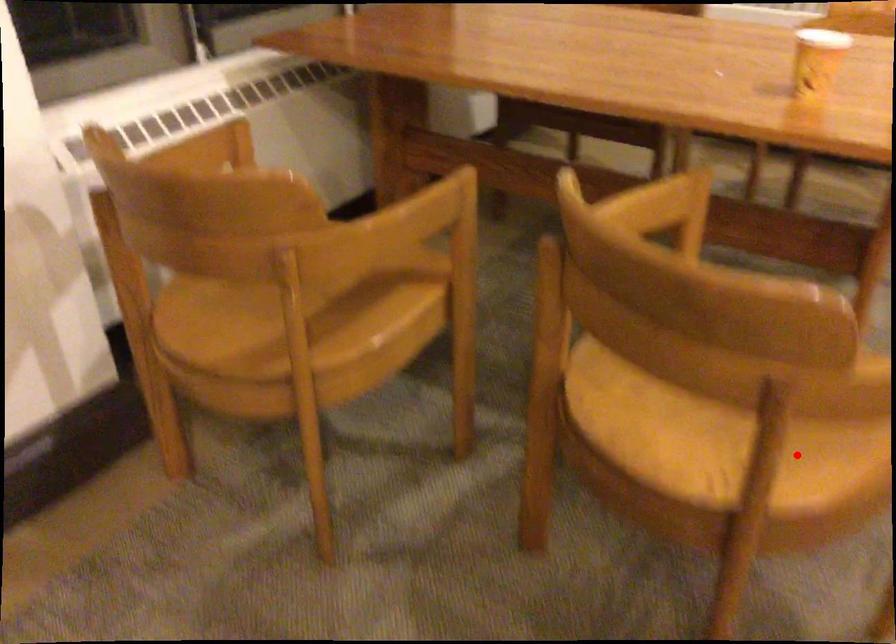
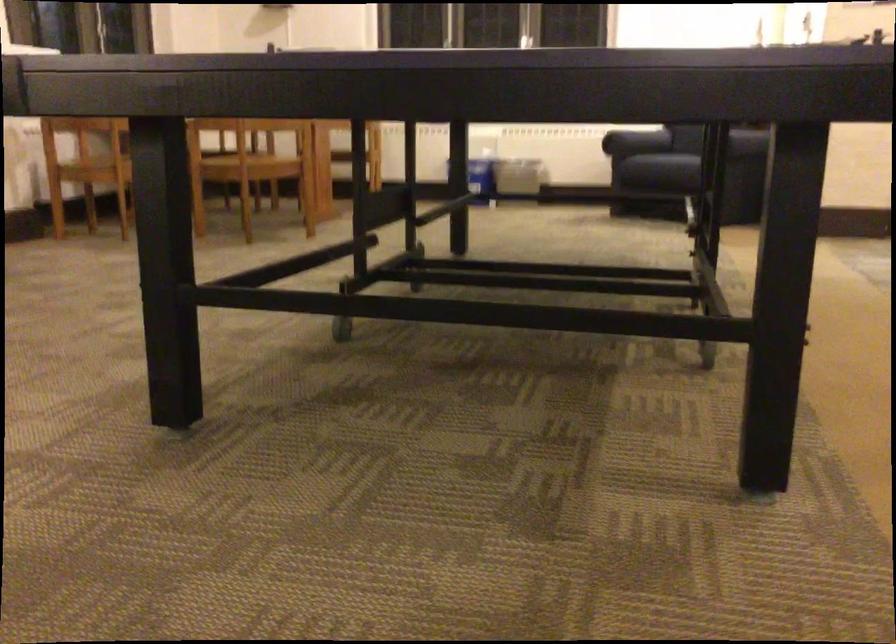
Question: I am providing you with two images of the same scene from different viewpoints. A red point is marked on the first image. Is the red point's position out of view in image 2?

Choices:
 (A) Yes
 (B) No

Answer: (B)